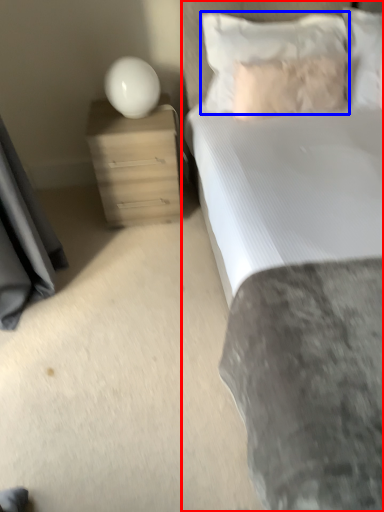
Question: Which point is closer to the camera, bed (highlighted by a red box) or pillow (highlighted by a blue box)?

Choices:
 (A) bed
 (B) pillow

Answer: (A)